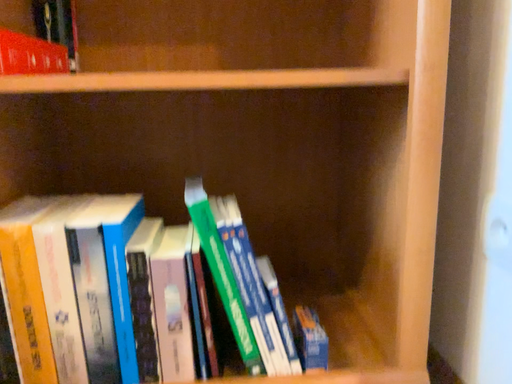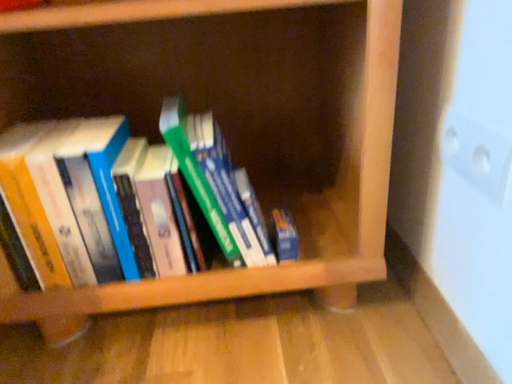
Question: Which way did the camera rotate in the video?

Choices:
 (A) rotated upward
 (B) rotated downward

Answer: (B)